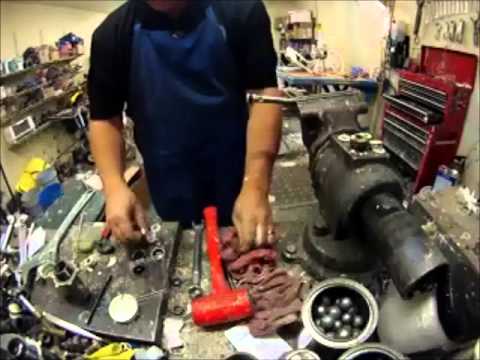
Identify the location of yellow rag. The height and width of the screenshot is (360, 480). point(38,162).